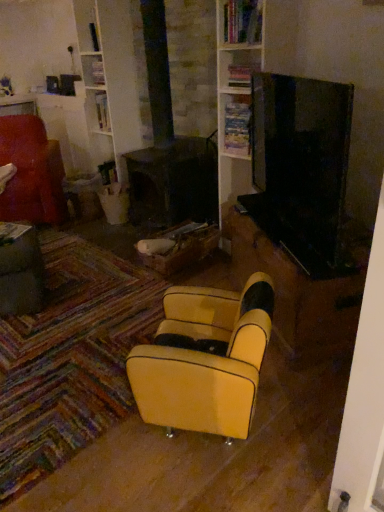
Question: Which direction should I rotate to look at wooden bookshelf at upper center, positioned as the second shelf in top-to-bottom order?

Choices:
 (A) left
 (B) right

Answer: (B)

Question: Is wooden bookshelf at upper center, which is the 2th shelf in bottom-to-top order, touching wooden bookshelf at upper center, which appears as the 1th shelf when ordered from the bottom?

Choices:
 (A) no
 (B) yes

Answer: (A)

Question: Is wooden bookshelf at upper center, which is the first shelf from top to bottom, further to the viewer compared to wooden bookshelf at upper center, positioned as the second shelf in top-to-bottom order?

Choices:
 (A) yes
 (B) no

Answer: (B)

Question: Can you confirm if wooden bookshelf at upper center, which is the first shelf from top to bottom, is taller than wooden bookshelf at upper center, which appears as the 1th shelf when ordered from the bottom?

Choices:
 (A) yes
 (B) no

Answer: (B)

Question: Is wooden bookshelf at upper center, which is the 2th shelf in bottom-to-top order, closer to the viewer compared to wooden bookshelf at upper center, which appears as the 1th shelf when ordered from the bottom?

Choices:
 (A) no
 (B) yes

Answer: (B)

Question: Can you confirm if wooden bookshelf at upper center, which is the first shelf from top to bottom, is thinner than wooden bookshelf at upper center, which appears as the 1th shelf when ordered from the bottom?

Choices:
 (A) yes
 (B) no

Answer: (B)

Question: Considering the relative positions of wooden bookshelf at upper center, which is the 2th shelf in bottom-to-top order, and wooden bookshelf at upper center, which appears as the 1th shelf when ordered from the bottom, in the image provided, is wooden bookshelf at upper center, which is the 2th shelf in bottom-to-top order, to the right of wooden bookshelf at upper center, which appears as the 1th shelf when ordered from the bottom, from the viewer's perspective?

Choices:
 (A) yes
 (B) no

Answer: (A)

Question: Does wooden bookshelf at upper center, which appears as the 1th shelf when ordered from the bottom, have a lesser height compared to metallic gray table at lower left?

Choices:
 (A) yes
 (B) no

Answer: (A)

Question: Can you confirm if wooden bookshelf at upper center, which appears as the 1th shelf when ordered from the bottom, is smaller than metallic gray table at lower left?

Choices:
 (A) yes
 (B) no

Answer: (A)

Question: Does wooden bookshelf at upper center, which appears as the 1th shelf when ordered from the bottom, touch metallic gray table at lower left?

Choices:
 (A) yes
 (B) no

Answer: (B)

Question: From the image's perspective, is wooden bookshelf at upper center, which appears as the 1th shelf when ordered from the bottom, located beneath metallic gray table at lower left?

Choices:
 (A) no
 (B) yes

Answer: (A)

Question: Can you confirm if wooden bookshelf at upper center, positioned as the second shelf in top-to-bottom order, is wider than metallic gray table at lower left?

Choices:
 (A) yes
 (B) no

Answer: (B)

Question: Does wooden bookshelf at upper center, positioned as the second shelf in top-to-bottom order, have a lesser width compared to metallic gray table at lower left?

Choices:
 (A) yes
 (B) no

Answer: (A)

Question: Considering the relative sizes of wooden bookshelf at upper center, which appears as the 1th shelf when ordered from the bottom, and velvet red armchair at left, which ranks as the 1th chair in back-to-front order, in the image provided, is wooden bookshelf at upper center, which appears as the 1th shelf when ordered from the bottom, thinner than velvet red armchair at left, which ranks as the 1th chair in back-to-front order,?

Choices:
 (A) no
 (B) yes

Answer: (B)